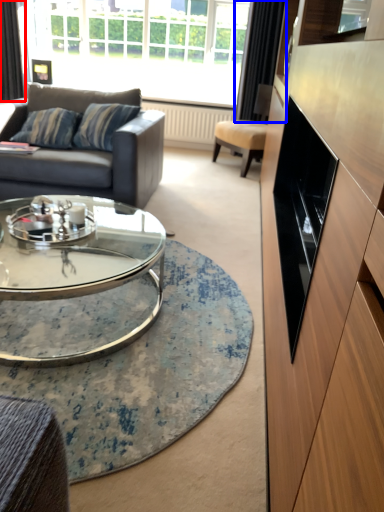
Question: Which object appears farthest to the camera in this image, curtain (highlighted by a red box) or curtain (highlighted by a blue box)?

Choices:
 (A) curtain
 (B) curtain

Answer: (A)